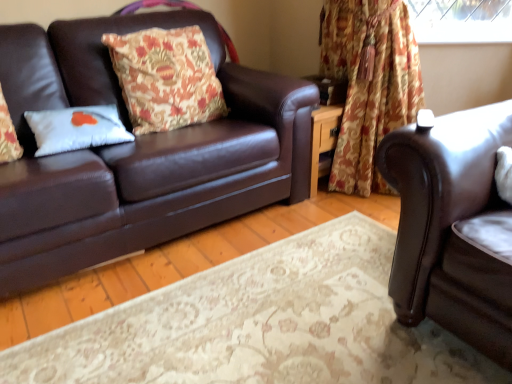
Question: From the image's perspective, would you say matte brown leather couch at left, which is counted as the first studio couch, starting from the left, is shown under floral fabric curtain at upper right?

Choices:
 (A) yes
 (B) no

Answer: (A)

Question: Could you tell me if matte brown leather couch at left, which is the second studio couch in right-to-left order, is facing floral fabric curtain at upper right?

Choices:
 (A) yes
 (B) no

Answer: (B)

Question: Considering the relative positions of matte brown leather couch at left, which is counted as the first studio couch, starting from the left, and floral fabric curtain at upper right in the image provided, is matte brown leather couch at left, which is counted as the first studio couch, starting from the left, to the right of floral fabric curtain at upper right from the viewer's perspective?

Choices:
 (A) no
 (B) yes

Answer: (A)

Question: Is matte brown leather couch at left, which is the second studio couch in right-to-left order, positioned far away from floral fabric curtain at upper right?

Choices:
 (A) yes
 (B) no

Answer: (B)

Question: Does matte brown leather couch at left, which is the second studio couch in right-to-left order, have a smaller size compared to floral fabric curtain at upper right?

Choices:
 (A) no
 (B) yes

Answer: (A)

Question: Is matte brown leather couch at left, which is counted as the first studio couch, starting from the left, next to floral fabric curtain at upper right and touching it?

Choices:
 (A) yes
 (B) no

Answer: (B)

Question: Is matte brown leather couch at left, which is counted as the first studio couch, starting from the left, taller than brown leather couch at right, the second studio couch positioned from the left?

Choices:
 (A) no
 (B) yes

Answer: (B)

Question: Is matte brown leather couch at left, which is counted as the first studio couch, starting from the left, looking in the opposite direction of brown leather couch at right, the second studio couch positioned from the left?

Choices:
 (A) no
 (B) yes

Answer: (A)

Question: From a real-world perspective, is matte brown leather couch at left, which is counted as the first studio couch, starting from the left, physically above brown leather couch at right, the second studio couch positioned from the left?

Choices:
 (A) yes
 (B) no

Answer: (A)

Question: Is the position of matte brown leather couch at left, which is counted as the first studio couch, starting from the left, less distant than that of brown leather couch at right, the second studio couch positioned from the left?

Choices:
 (A) no
 (B) yes

Answer: (A)

Question: Can you confirm if matte brown leather couch at left, which is counted as the first studio couch, starting from the left, is bigger than brown leather couch at right, the second studio couch positioned from the left?

Choices:
 (A) yes
 (B) no

Answer: (A)

Question: Is matte brown leather couch at left, which is counted as the first studio couch, starting from the left, to the left of brown leather couch at right, which is the first studio couch from right to left, from the viewer's perspective?

Choices:
 (A) yes
 (B) no

Answer: (A)

Question: Would you say white matte pillow at left, the second pillow viewed from the right, contains floral-patterned fabric pillow at left, the first pillow viewed from the right?

Choices:
 (A) no
 (B) yes

Answer: (A)